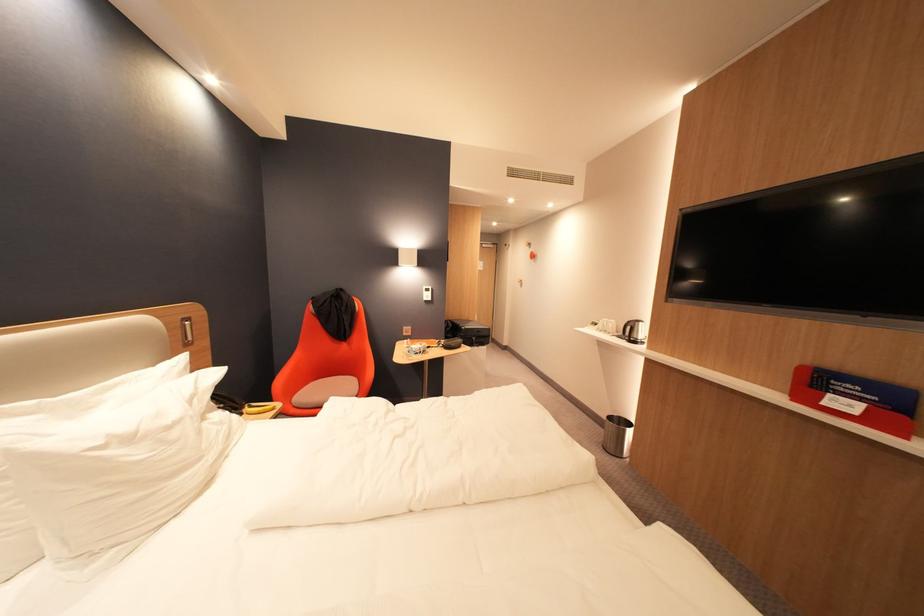
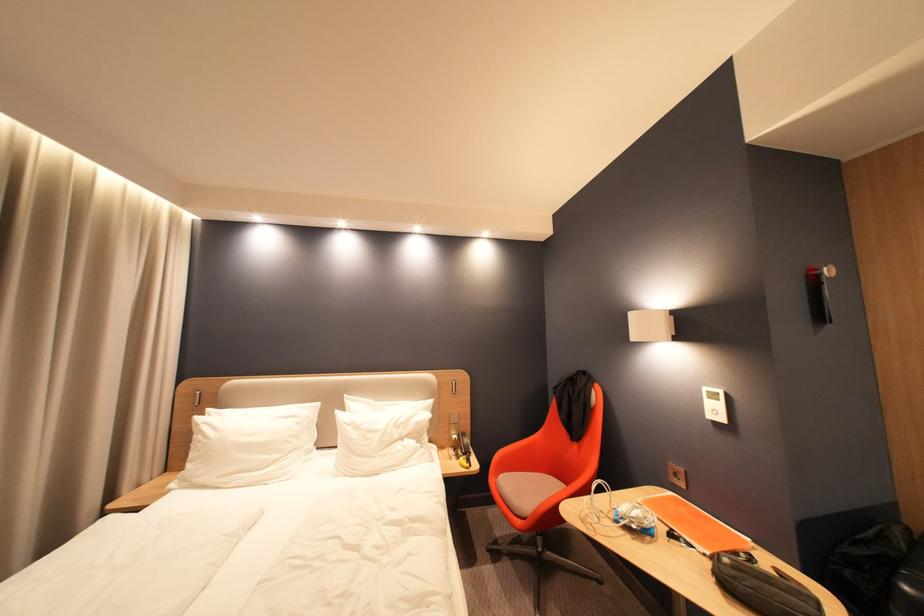
In the second image, find the point that corresponds to point (444, 346) in the first image.

(710, 544)